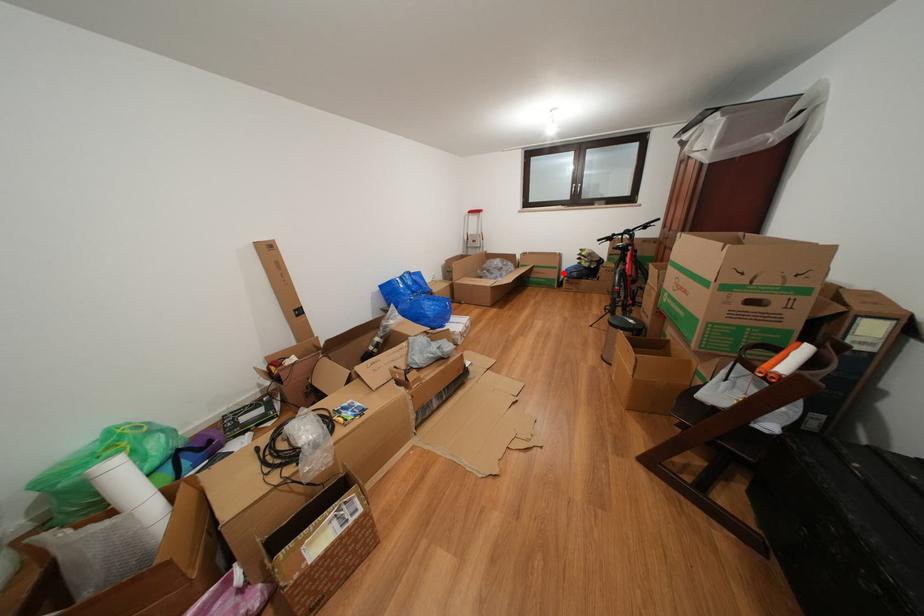
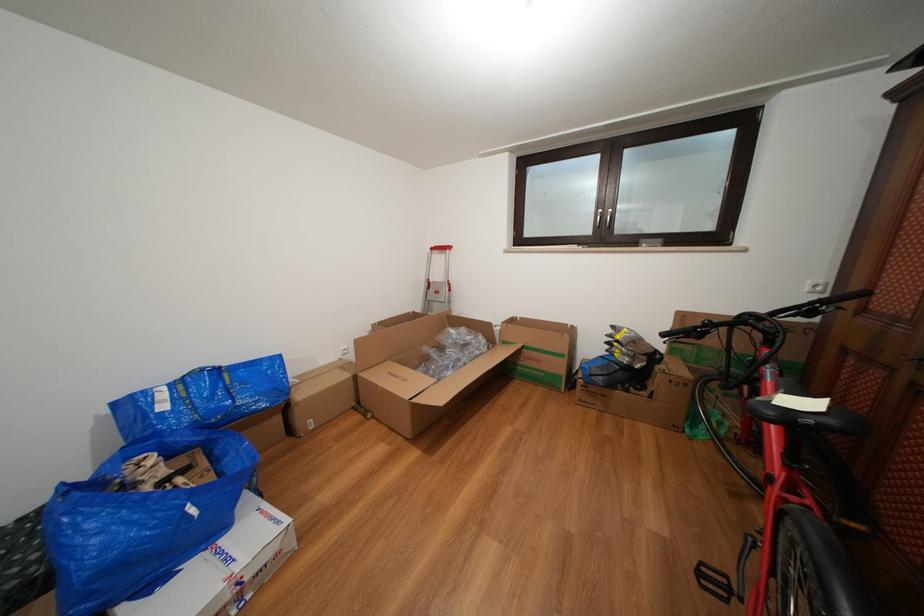
Question: I am providing you with two images of the same scene from different viewpoints. In image1, a red point is highlighted. Considering the same 3D point in image2, which of the following is correct?

Choices:
 (A) It is closer
 (B) It is farther

Answer: (B)